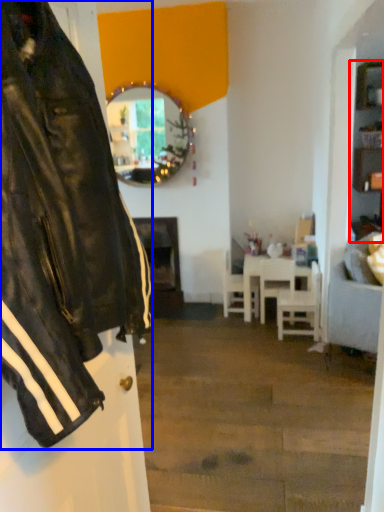
Question: Which of the following is the farthest to the observer, cabinetry (highlighted by a red box) or jacket (highlighted by a blue box)?

Choices:
 (A) cabinetry
 (B) jacket

Answer: (A)